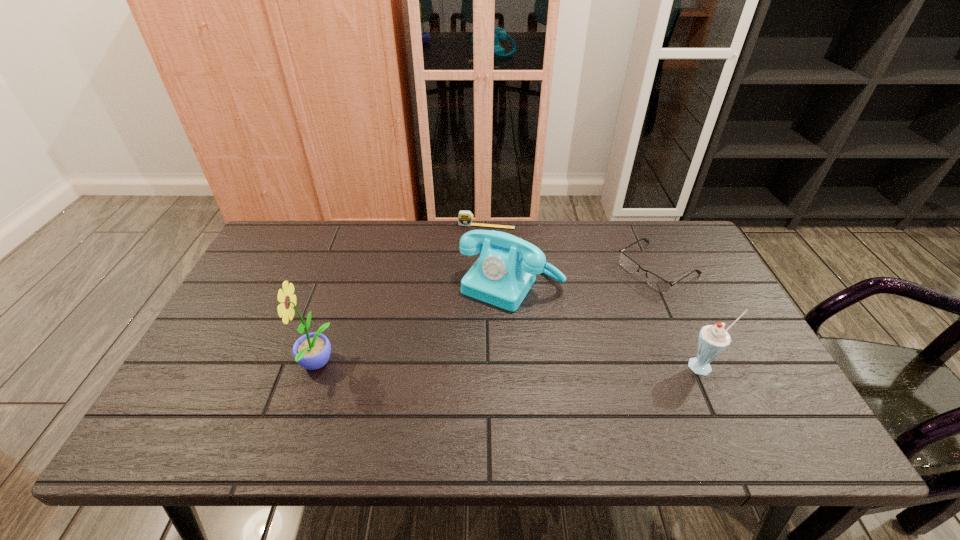
Locate an element on the screen. The width and height of the screenshot is (960, 540). free space located on the dial of the telephone is located at coordinates (431, 393).

Where is `vacant space located 0.180m on the dial of the telephone`? vacant space located 0.180m on the dial of the telephone is located at coordinates (457, 355).

Where is `vacant space located 0.210m on the dial of the telephone`? vacant space located 0.210m on the dial of the telephone is located at coordinates (450, 364).

Identify the location of vacant area located on the front-facing side of the spectacles. This screenshot has height=540, width=960. (558, 331).

Where is `vacant region located on the front-facing side of the spectacles`? This screenshot has width=960, height=540. vacant region located on the front-facing side of the spectacles is located at coordinates (540, 341).

Identify the location of vacant space situated 0.170m on the front-facing side of the spectacles. This screenshot has height=540, width=960. (592, 309).

You are a GUI agent. You are given a task and a screenshot of the screen. Output one action in this format:
    pyautogui.click(x=<x>, y=<y>)
    Task: Click on the vacant space located 0.390m at the front of the tape measure with the tape extended
    This screenshot has width=960, height=540.
    Given the screenshot: What is the action you would take?
    pyautogui.click(x=464, y=313)

This screenshot has height=540, width=960. Find the location of `vacant region located at the front of the tape measure with the tape extended`. vacant region located at the front of the tape measure with the tape extended is located at coordinates (465, 310).

I want to click on blank space located at the front of the tape measure with the tape extended, so click(470, 286).

Locate an element on the screen. Image resolution: width=960 pixels, height=540 pixels. telephone present at the far edge is located at coordinates (507, 267).